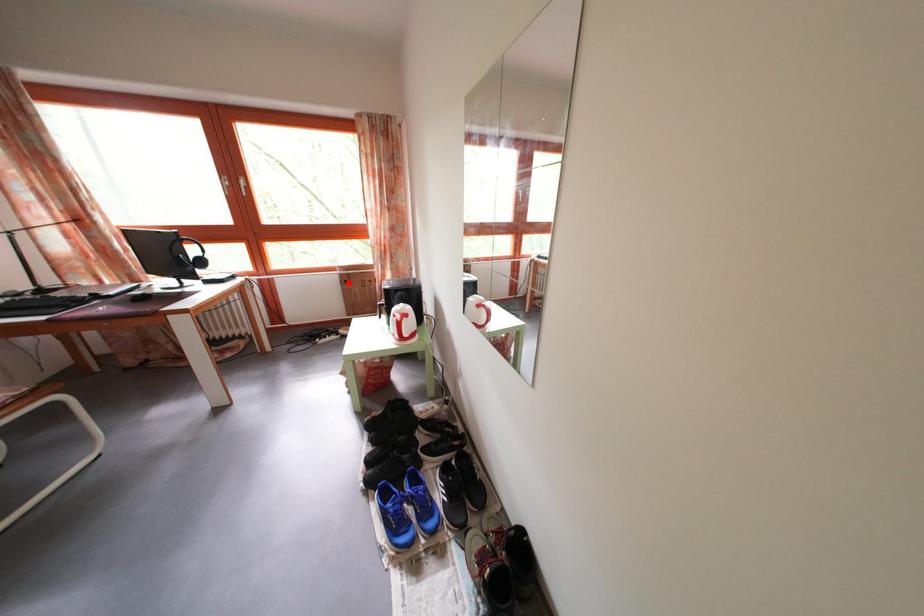
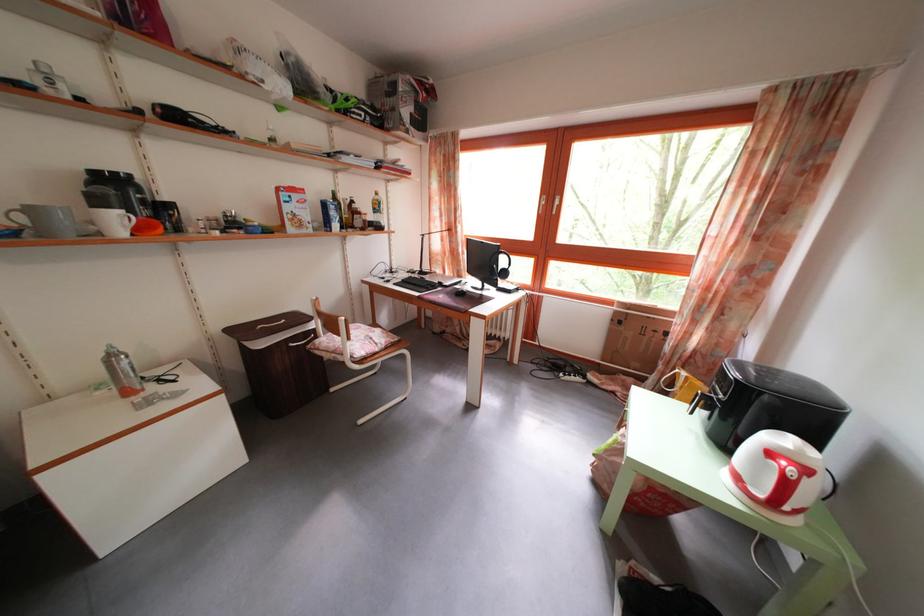
Question: A red point is marked in image1. In image2, is the corresponding 3D point closer to the camera or farther? Reply with the corresponding letter.

Choices:
 (A) The corresponding 3D point is closer.
 (B) The corresponding 3D point is farther.

Answer: (B)